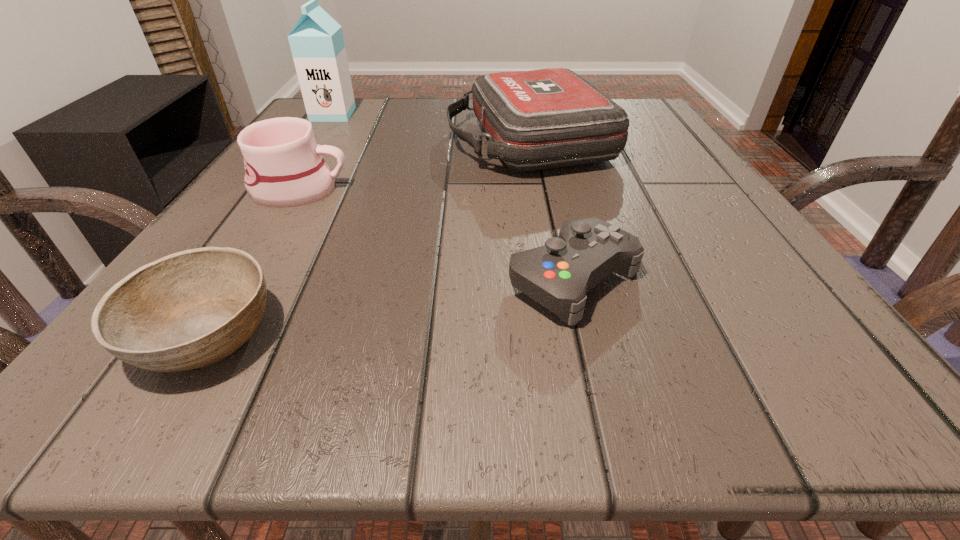
Identify the location of vacant space in between the milk carton and the control. (453, 197).

Find the location of a particular element. The image size is (960, 540). vacant area that lies between the control and the mug is located at coordinates (437, 234).

I want to click on empty space that is in between the bowl and the control, so click(x=389, y=307).

Where is `the third closest object to the bowl`? the third closest object to the bowl is located at coordinates (547, 118).

Choose which object is the nearest neighbor to the control. Please provide its 2D coordinates. Your answer should be formatted as a tuple, i.e. [(x, y)], where the tuple contains the x and y coordinates of a point satisfying the conditions above.

[(547, 118)]

At what (x,y) coordinates should I click in order to perform the action: click on free space that satisfies the following two spatial constraints: 1. on the back side of the control; 2. on the side with the handle of the mug. Please return your answer as a coordinate pair (x, y). This screenshot has height=540, width=960. Looking at the image, I should click on (552, 189).

Locate an element on the screen. free space in the image that satisfies the following two spatial constraints: 1. on the back side of the bowl; 2. on the right side of the control is located at coordinates (238, 280).

Locate an element on the screen. This screenshot has height=540, width=960. free point that satisfies the following two spatial constraints: 1. on the back side of the control; 2. on the right side of the bowl is located at coordinates (238, 280).

In order to click on free space that satisfies the following two spatial constraints: 1. on the side with the handle of the mug; 2. on the right side of the control in this screenshot , I will do `click(244, 280)`.

The image size is (960, 540). In order to click on vacant region that satisfies the following two spatial constraints: 1. on the side with the handle of the mug; 2. on the front side of the bowl in this screenshot , I will do `click(211, 334)`.